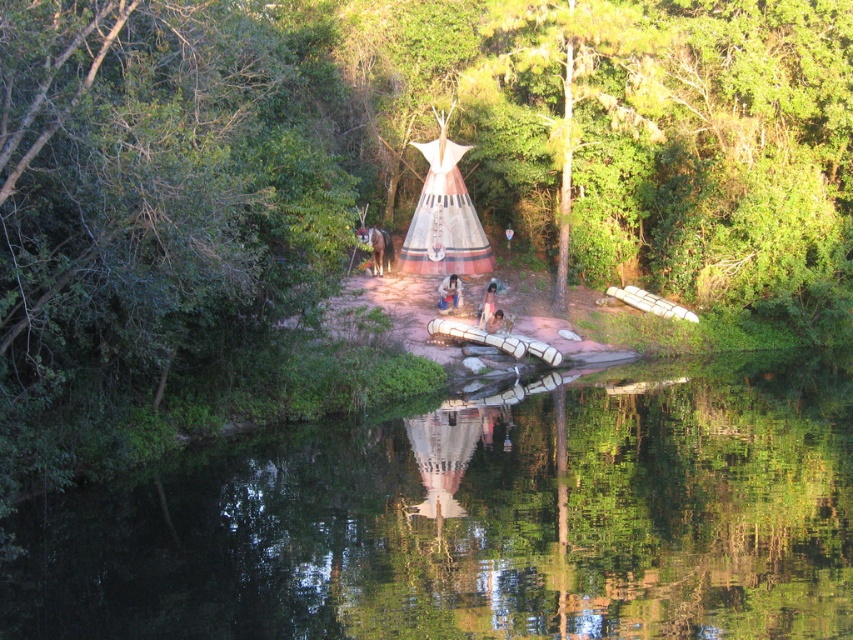
Is point (440, 291) farther from camera compared to point (488, 330)?

That is True.

Where is `smooth skin face at center`? The height and width of the screenshot is (640, 853). smooth skin face at center is located at coordinates (450, 292).

This screenshot has height=640, width=853. Find the location of `smooth skin face at center`. smooth skin face at center is located at coordinates (450, 292).

Consider the image. Is tan skin person at center thinner than brown leather jacket at center?

Indeed, tan skin person at center has a lesser width compared to brown leather jacket at center.

Does point (480, 324) come behind point (508, 323)?

No, (480, 324) is in front of (508, 323).

Is point (480, 328) positioned after point (492, 330)?

No, it is not.

Locate an element on the screen. tan skin person at center is located at coordinates (486, 305).

Consider the image. Can you confirm if green leafy tree at center is wider than smooth skin face at center?

Yes.

Which is more to the right, green leafy tree at center or smooth skin face at center?

green leafy tree at center is more to the right.

Does point (527, 4) come closer to viewer compared to point (450, 285)?

Yes.

You are a GUI agent. You are given a task and a screenshot of the screen. Output one action in this format:
    pyautogui.click(x=<x>, y=<y>)
    Task: Click on the green leafy tree at center
    The height and width of the screenshot is (640, 853).
    Given the screenshot: What is the action you would take?
    pyautogui.click(x=566, y=83)